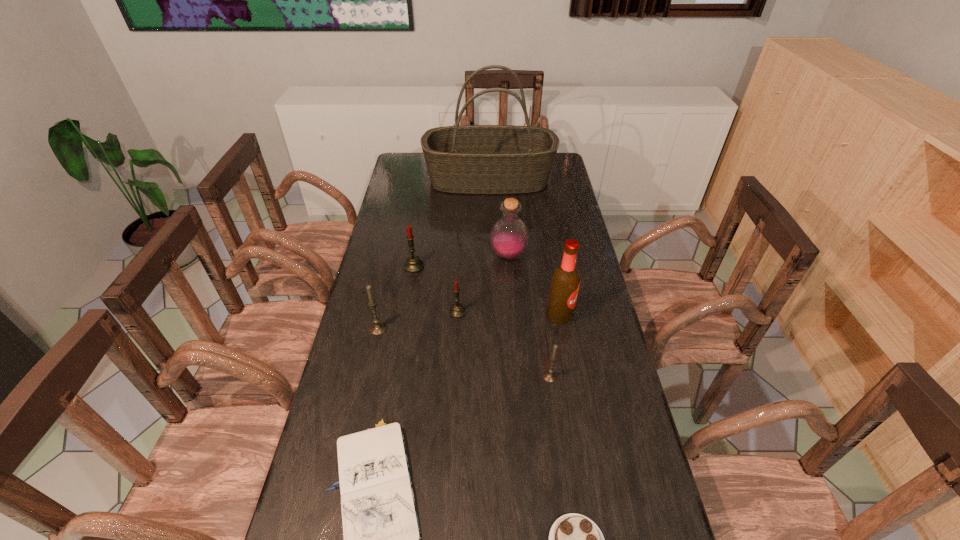
Find the location of a particular element. the second candle from right to left is located at coordinates (457, 310).

Where is `the smaller gray candle`? The width and height of the screenshot is (960, 540). the smaller gray candle is located at coordinates (550, 375).

I want to click on the rightmost candle, so click(550, 375).

Locate an element on the screen. This screenshot has width=960, height=540. free location located 0.340m on the front of the farthest object is located at coordinates (492, 248).

Where is `vacant space located 0.290m on the left of the beer bottle`? This screenshot has height=540, width=960. vacant space located 0.290m on the left of the beer bottle is located at coordinates (452, 316).

Find the location of a particular element. This screenshot has width=960, height=540. free location located 0.300m on the left of the bottle is located at coordinates (406, 256).

Where is `free region located on the left of the left red candle`? The height and width of the screenshot is (540, 960). free region located on the left of the left red candle is located at coordinates (387, 267).

Identify the location of free spot located 0.280m on the back of the left gray candle. (393, 262).

You are a GUI agent. You are given a task and a screenshot of the screen. Output one action in this format:
    pyautogui.click(x=<x>, y=<y>)
    Task: Click on the free space located 0.370m on the front of the second candle from right to left
    This screenshot has height=540, width=960.
    Given the screenshot: What is the action you would take?
    pyautogui.click(x=452, y=430)

Find the location of a particular element. vacant space located 0.080m on the right of the smaller gray candle is located at coordinates (587, 376).